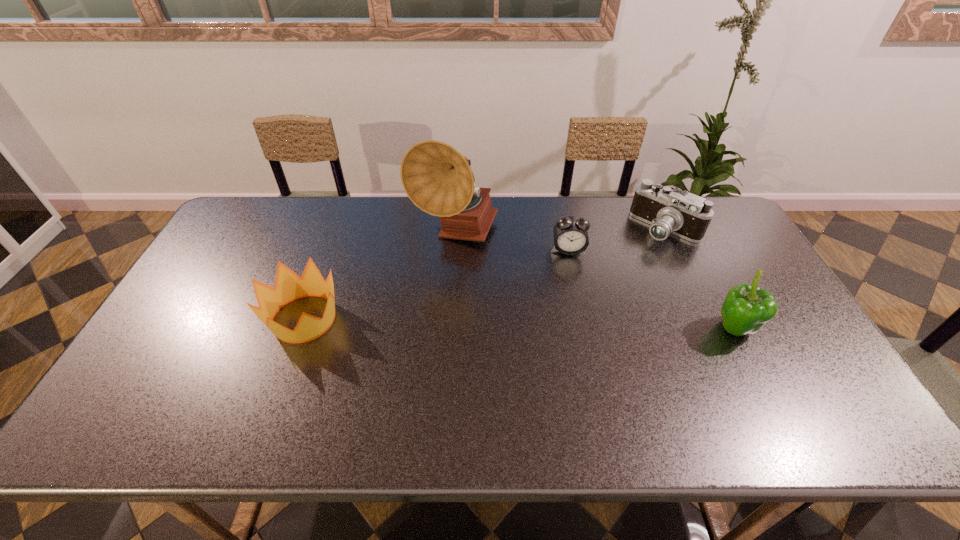
Image resolution: width=960 pixels, height=540 pixels. I want to click on free space located 0.080m on the horn of the tallest object, so click(467, 281).

I want to click on blank space located 0.400m on the front side of the third object from right to left, so click(x=584, y=366).

Where is `free space located 0.100m on the front side of the third object from right to left`? This screenshot has width=960, height=540. free space located 0.100m on the front side of the third object from right to left is located at coordinates (572, 281).

Identify the location of blank space located 0.090m on the front side of the third object from right to left. The height and width of the screenshot is (540, 960). (571, 278).

At what (x,y) coordinates should I click in order to perform the action: click on vacant space located at the lens of the camera. Please return your answer as a coordinate pair (x, y). This screenshot has width=960, height=540. Looking at the image, I should click on (568, 303).

Locate an element on the screen. Image resolution: width=960 pixels, height=540 pixels. free region located at the lens of the camera is located at coordinates (603, 277).

In order to click on blank space located at the lens of the camera in this screenshot , I will do `click(607, 274)`.

The height and width of the screenshot is (540, 960). Identify the location of phonograph record positioned at the far edge. (435, 176).

Where is `camera that is at the far edge`? The width and height of the screenshot is (960, 540). camera that is at the far edge is located at coordinates (686, 215).

Image resolution: width=960 pixels, height=540 pixels. I want to click on bell pepper located in the right edge section of the desktop, so click(x=747, y=308).